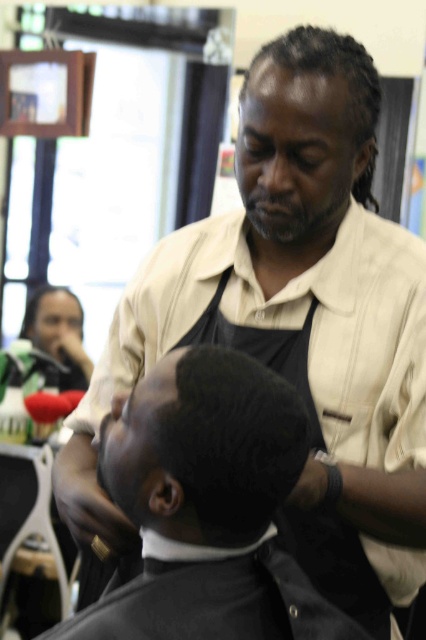
Measure the distance between black matte hair at center and camera.

black matte hair at center and camera are 35.01 inches apart.

Is the position of black matte hair at center less distant than that of black textured hair at center?

Yes, it is.

Image resolution: width=426 pixels, height=640 pixels. What do you see at coordinates (207, 508) in the screenshot? I see `black matte hair at center` at bounding box center [207, 508].

Locate an element on the screen. The image size is (426, 640). black matte hair at center is located at coordinates [207, 508].

The height and width of the screenshot is (640, 426). What do you see at coordinates (334, 84) in the screenshot?
I see `sleek black hair at center` at bounding box center [334, 84].

Can you confirm if sleek black hair at center is positioned to the right of matte black phone at upper left?

Correct, you'll find sleek black hair at center to the right of matte black phone at upper left.

In order to click on sleek black hair at center in this screenshot , I will do `click(334, 84)`.

Is black matte hair at center below blonde hair at upper left?

Correct, black matte hair at center is located below blonde hair at upper left.

Which is behind, point (164, 545) or point (80, 332)?

Positioned behind is point (80, 332).

Identify the location of black matte hair at center. (207, 508).